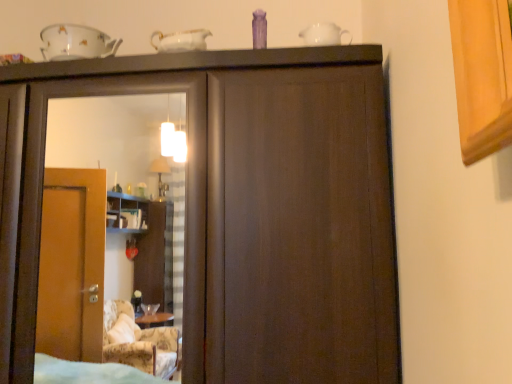
At what (x,y) coordinates should I click in order to perform the action: click on dark wood cupboard at center. Please return your answer as a coordinate pair (x, y). Looking at the image, I should click on (241, 209).

This screenshot has width=512, height=384. What do you see at coordinates (241, 209) in the screenshot?
I see `dark wood cupboard at center` at bounding box center [241, 209].

Find the location of a particular element. dark wood cupboard at center is located at coordinates (241, 209).